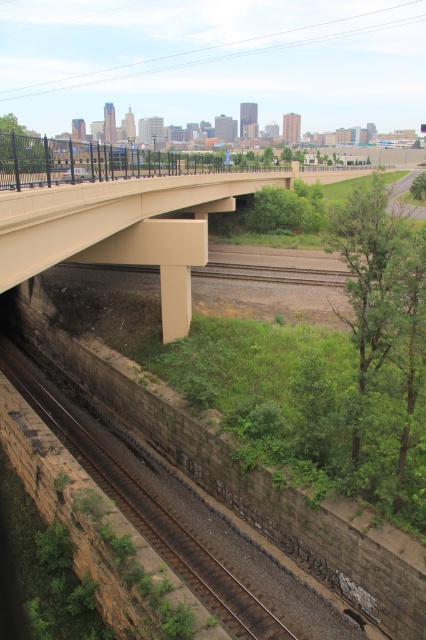
Question: Does green leafy tree at right have a smaller size compared to green leafy tree at left?

Choices:
 (A) yes
 (B) no

Answer: (A)

Question: Estimate the real-world distances between objects in this image. Which object is closer to the green leafy tree at center?

Choices:
 (A) green leafy tree at center-right
 (B) green leafy tree at right

Answer: (B)

Question: Which of the following is the closest to the observer?

Choices:
 (A) (351, 216)
 (B) (296, 220)
 (C) (25, 160)
 (D) (423, 173)

Answer: (A)

Question: Which point is farther from the camera taking this photo?

Choices:
 (A) (414, 196)
 (B) (363, 314)
 (C) (265, 230)
 (D) (22, 163)

Answer: (A)

Question: Is green leafy tree at center positioned at the back of green leafy tree at left?

Choices:
 (A) no
 (B) yes

Answer: (B)

Question: Can you confirm if green leafy tree at left is smaller than green leafy tree at center-right?

Choices:
 (A) yes
 (B) no

Answer: (B)